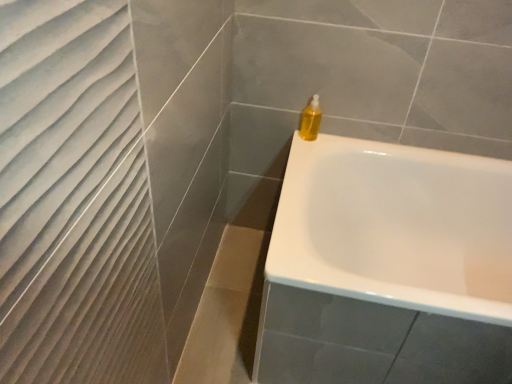
Question: Is translucent yellow liquid at upper right in front of or behind white glossy bathtub at upper right in the image?

Choices:
 (A) front
 (B) behind

Answer: (B)

Question: In terms of height, does translucent yellow liquid at upper right look taller or shorter compared to white glossy bathtub at upper right?

Choices:
 (A) tall
 (B) short

Answer: (B)

Question: From a real-world perspective, is translucent yellow liquid at upper right above or below white glossy bathtub at upper right?

Choices:
 (A) above
 (B) below

Answer: (A)

Question: Considering their positions, is white glossy bathtub at upper right located in front of or behind translucent yellow liquid at upper right?

Choices:
 (A) behind
 (B) front

Answer: (B)

Question: Is white glossy bathtub at upper right to the left or to the right of translucent yellow liquid at upper right in the image?

Choices:
 (A) right
 (B) left

Answer: (A)

Question: Would you say white glossy bathtub at upper right is inside or outside translucent yellow liquid at upper right?

Choices:
 (A) outside
 (B) inside

Answer: (A)

Question: Is white glossy bathtub at upper right bigger or smaller than translucent yellow liquid at upper right?

Choices:
 (A) big
 (B) small

Answer: (A)